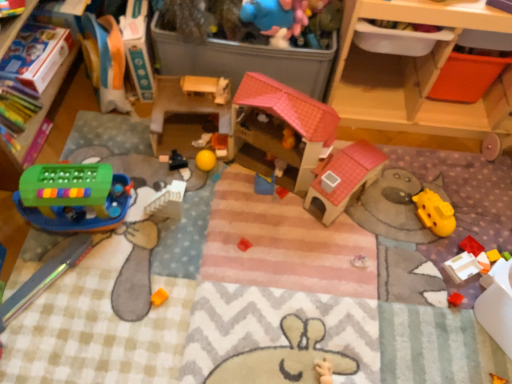
Question: Considering the positions of white matte figurine at center, arranged as the sixth toy when viewed from the right, and yellow rubber ball at center, which is counted as the 4th toy, starting from the right, in the image, is white matte figurine at center, arranged as the sixth toy when viewed from the right, wider or thinner than yellow rubber ball at center, which is counted as the 4th toy, starting from the right,?

Choices:
 (A) wide
 (B) thin

Answer: (B)

Question: From the image's perspective, is white matte figurine at center, which ranks as the 4th toy in left-to-right order, located above or below yellow rubber ball at center, which appears as the sixth toy when viewed from the left?

Choices:
 (A) below
 (B) above

Answer: (B)

Question: Considering the real-world distances, which object is farthest from the yellow rubber ball at center, which appears as the sixth toy when viewed from the left?

Choices:
 (A) wooden drawer at upper right
 (B) wooden dollhouse at center, which is counted as the 3th toy, starting from the left
 (C) green plastic boat at left, the 1th toy viewed from the left
 (D) bright red plastic block at lower right, the ninth toy positioned from the left
 (E) yellow plastic spoon at center, the 7th toy when ordered from left to right

Answer: (D)

Question: Which is farther from the bright red plastic block at lower right, the ninth toy positioned from the left?

Choices:
 (A) yellow rubber ball at center, the fifth toy in the right-to-left sequence
 (B) white matte figurine at center, which ranks as the 4th toy in left-to-right order
 (C) green plastic boat at left, the 1th toy viewed from the left
 (D) yellow rubber ball at center, which appears as the sixth toy when viewed from the left
 (E) wooden dollhouse at center, which is counted as the seventh toy, starting from the right

Answer: (C)